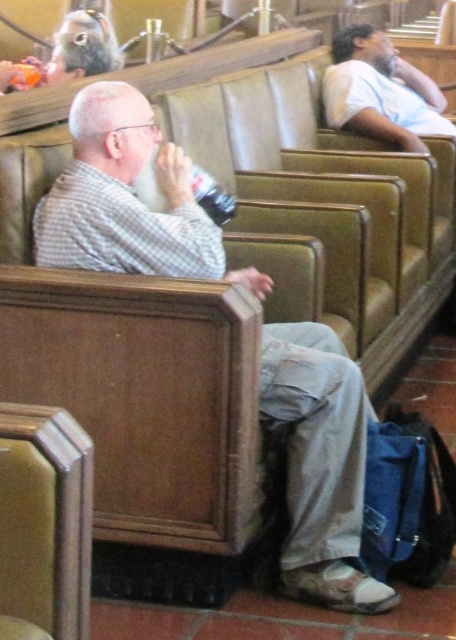
Question: Can you confirm if matte plaid shirt at center is wider than light brown leather shirt at upper right?

Choices:
 (A) yes
 (B) no

Answer: (A)

Question: Is light brown leather shirt at upper right bigger than matte black hair at upper left?

Choices:
 (A) no
 (B) yes

Answer: (B)

Question: Estimate the real-world distances between objects in this image. Which object is farther from the matte plaid shirt at center?

Choices:
 (A) light brown leather shirt at upper right
 (B) clear plastic bottle at center
 (C) matte black hair at upper left

Answer: (A)

Question: Based on their relative distances, which object is farther from the matte black hair at upper left?

Choices:
 (A) matte plaid shirt at center
 (B) clear plastic bottle at center

Answer: (A)

Question: Does matte plaid shirt at center appear under matte black hair at upper left?

Choices:
 (A) yes
 (B) no

Answer: (A)

Question: Based on their relative distances, which object is nearer to the clear plastic bottle at center?

Choices:
 (A) matte black hair at upper left
 (B) light brown leather shirt at upper right
 (C) matte plaid shirt at center

Answer: (C)